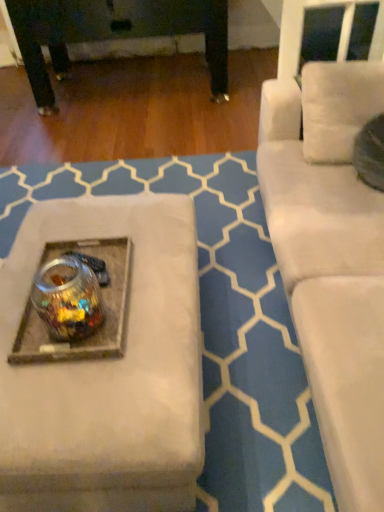
The width and height of the screenshot is (384, 512). In order to click on transparent glass jar at center in this screenshot , I will do `click(67, 298)`.

The image size is (384, 512). What do you see at coordinates (67, 298) in the screenshot? I see `transparent glass jar at center` at bounding box center [67, 298].

What are the coordinates of `clear glass jar at center` in the screenshot? It's located at (103, 303).

In order to face clear glass jar at center, should I rotate leftwards or rightwards?

To face it directly, rotate left by 15.252 degrees.

Describe the element at coordinates (103, 303) in the screenshot. The width and height of the screenshot is (384, 512). I see `clear glass jar at center` at that location.

At what (x,y) coordinates should I click in order to perform the action: click on transparent glass jar at center. Please return your answer as a coordinate pair (x, y). This screenshot has width=384, height=512. Looking at the image, I should click on (67, 298).

Which is more to the left, transparent glass jar at center or clear glass jar at center?

clear glass jar at center is more to the left.

Considering the relative positions of transparent glass jar at center and clear glass jar at center in the image provided, is transparent glass jar at center behind clear glass jar at center?

No, it is in front of clear glass jar at center.

Which is closer to the camera, (41, 317) or (29, 318)?

The point (41, 317) is closer to the camera.

Based on the photo, from the image's perspective, which is above, transparent glass jar at center or clear glass jar at center?

From the image's view, clear glass jar at center is above.

From a real-world perspective, is transparent glass jar at center beneath clear glass jar at center?

No.

Between transparent glass jar at center and clear glass jar at center, which one has smaller width?

transparent glass jar at center.

Can you confirm if transparent glass jar at center is shorter than clear glass jar at center?

No.

Looking at the image, does transparent glass jar at center seem bigger or smaller compared to clear glass jar at center?

Clearly, transparent glass jar at center is larger in size than clear glass jar at center.

Would you say transparent glass jar at center is outside clear glass jar at center?

Absolutely, transparent glass jar at center is external to clear glass jar at center.

Based on the photo, would you say transparent glass jar at center is a long distance from clear glass jar at center?

No, transparent glass jar at center is in close proximity to clear glass jar at center.

Is transparent glass jar at center turned away from clear glass jar at center?

No, transparent glass jar at center is not facing away from clear glass jar at center.

What's the angular difference between transparent glass jar at center and clear glass jar at center's facing directions?

transparent glass jar at center and clear glass jar at center are facing 0.000875 degrees away from each other.

How much distance is there between transparent glass jar at center and clear glass jar at center?

transparent glass jar at center is 3.16 inches away from clear glass jar at center.

Locate an element on the screen. The height and width of the screenshot is (512, 384). beverage below the clear glass jar at center (from the image's perspective) is located at coordinates (67, 298).

In the scene shown: Considering the positions of objects clear glass jar at center and transparent glass jar at center in the image provided, who is more to the left, clear glass jar at center or transparent glass jar at center?

clear glass jar at center is more to the left.

Who is more distant, clear glass jar at center or transparent glass jar at center?

clear glass jar at center is further away from the camera.

Does point (118, 290) lie in front of point (90, 288)?

That is False.

From the image's perspective, which is below, clear glass jar at center or transparent glass jar at center?

From the image's view, transparent glass jar at center is below.

From a real-world perspective, is clear glass jar at center positioned over transparent glass jar at center based on gravity?

Incorrect, from a real-world perspective, clear glass jar at center is lower than transparent glass jar at center.

Does clear glass jar at center have a lesser width compared to transparent glass jar at center?

No.

Considering the sizes of clear glass jar at center and transparent glass jar at center in the image, is clear glass jar at center taller or shorter than transparent glass jar at center?

In the image, clear glass jar at center appears to be shorter than transparent glass jar at center.

In terms of size, does clear glass jar at center appear bigger or smaller than transparent glass jar at center?

In the image, clear glass jar at center appears to be smaller than transparent glass jar at center.

Is clear glass jar at center located outside transparent glass jar at center?

clear glass jar at center is positioned outside transparent glass jar at center.

Is clear glass jar at center next to transparent glass jar at center and touching it?

Yes, the surface of clear glass jar at center is in contact with transparent glass jar at center.

Is clear glass jar at center facing towards transparent glass jar at center?

No.

Can you tell me how much clear glass jar at center and transparent glass jar at center differ in facing direction?

They differ by 0.000875 degrees in their facing directions.

How much distance is there between clear glass jar at center and transparent glass jar at center?

clear glass jar at center and transparent glass jar at center are 3.16 inches apart.

Locate an element on the screen. beverage above the clear glass jar at center (from a real-world perspective) is located at coordinates (67, 298).

At what (x,y) coordinates should I click in order to perform the action: click on round table behind the transparent glass jar at center. Please return your answer as a coordinate pair (x, y). The image size is (384, 512). Looking at the image, I should click on (103, 303).

The height and width of the screenshot is (512, 384). In the image, there is a transparent glass jar at center. Identify the location of round table above it (from the image's perspective). (103, 303).